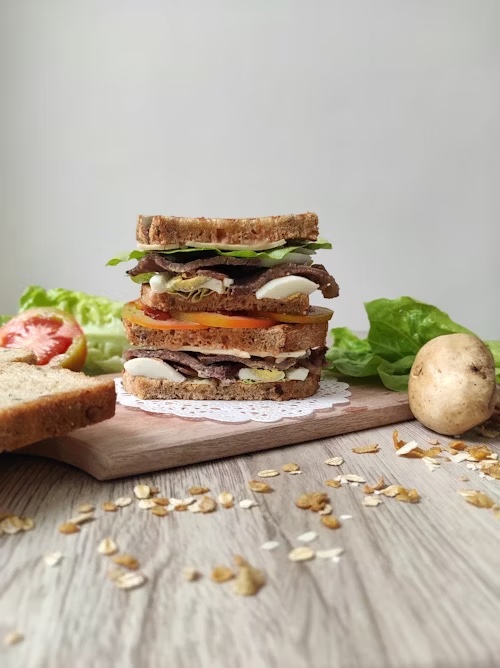
At what (x,y) coordinates should I click in order to perform the action: click on white cloth. Please return your answer as a coordinate pair (x, y). The width and height of the screenshot is (500, 668). Looking at the image, I should click on (238, 407).